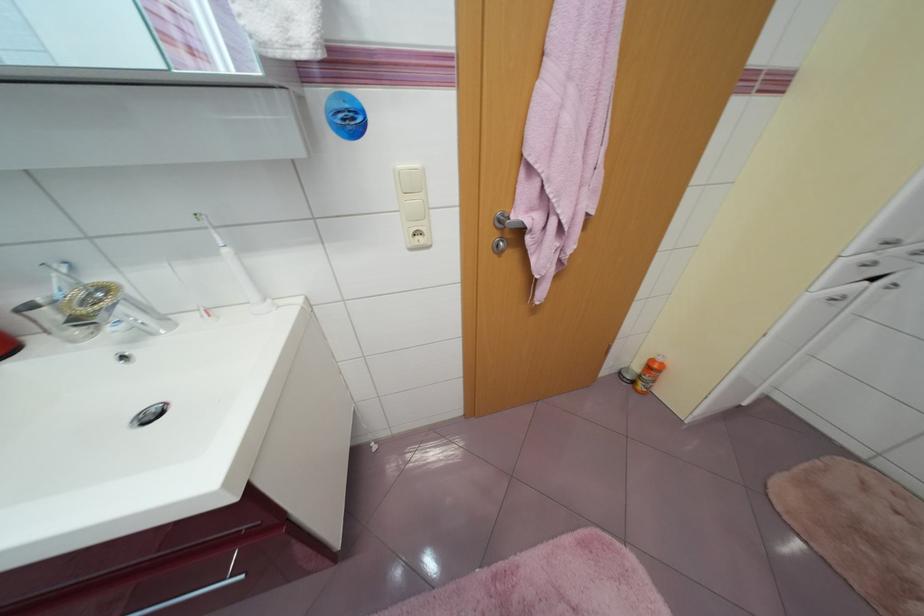
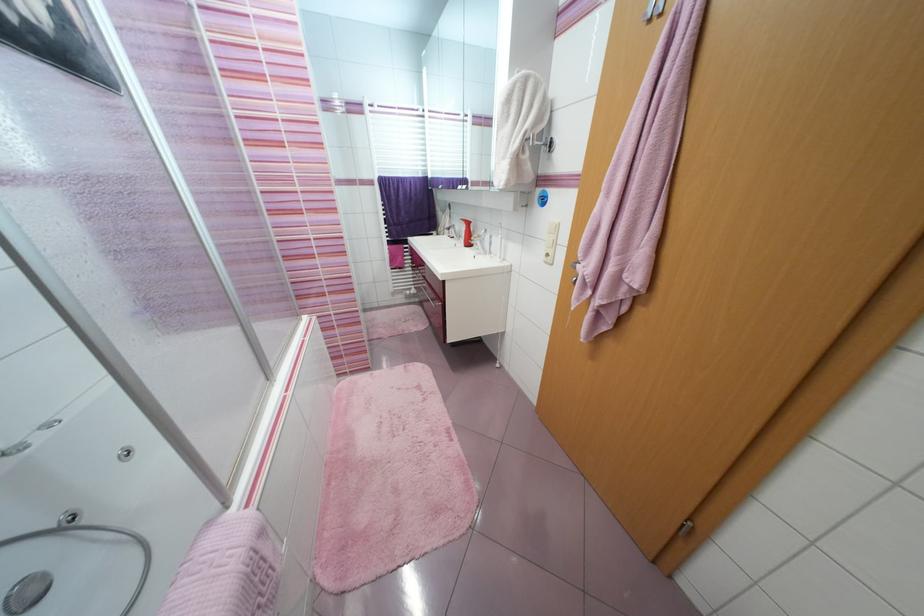
In the second image, find the point that corresponds to the point at 239,500 in the first image.

(445, 281)